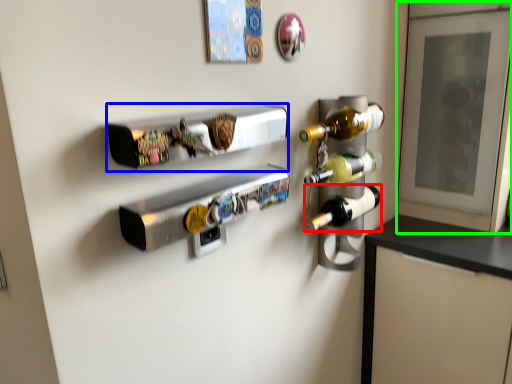
Question: Considering the real-world distances, which object is farthest from bottle (highlighted by a red box)? shelf (highlighted by a blue box) or glass door (highlighted by a green box)?

Choices:
 (A) shelf
 (B) glass door

Answer: (B)